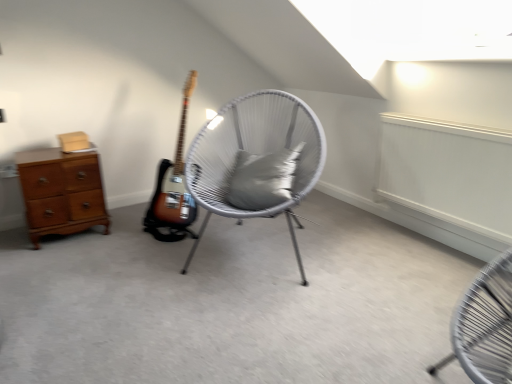
I want to click on free space in front of wooden chest of drawers at left, so click(x=55, y=255).